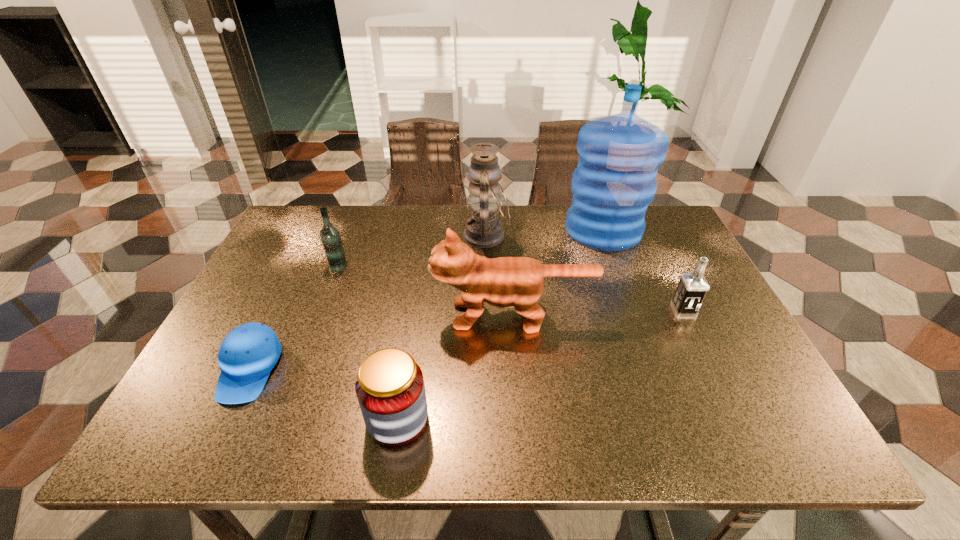
The width and height of the screenshot is (960, 540). What are the coordinates of `free space between the leftmost object and the jar` in the screenshot? It's located at (324, 394).

Find the location of `free space between the jar and the left vodka`. free space between the jar and the left vodka is located at coordinates (368, 342).

The width and height of the screenshot is (960, 540). I want to click on free space between the jar and the sixth shortest object, so click(442, 327).

Identify the location of vacant region between the tallest object and the right vodka. This screenshot has width=960, height=540. (643, 270).

I want to click on vacant space in between the left vodka and the cap, so click(x=294, y=317).

Where is `free space between the tallest object and the farther vodka`? The height and width of the screenshot is (540, 960). free space between the tallest object and the farther vodka is located at coordinates (470, 247).

At what (x,y) coordinates should I click in order to perform the action: click on unoccupied position between the cap and the water jug. Please return your answer as a coordinate pair (x, y). The height and width of the screenshot is (540, 960). Looking at the image, I should click on (426, 299).

Point out which object is positioned as the second nearest to the farther vodka. Please provide its 2D coordinates. Your answer should be formatted as a tuple, i.e. [(x, y)], where the tuple contains the x and y coordinates of a point satisfying the conditions above.

[(503, 282)]

Image resolution: width=960 pixels, height=540 pixels. I want to click on object that is the fifth closest to the left vodka, so click(619, 155).

The height and width of the screenshot is (540, 960). Find the location of `vacant space that satisfies the following two spatial constraints: 1. on the front label of the nearer vodka; 2. on the face of the cat`. vacant space that satisfies the following two spatial constraints: 1. on the front label of the nearer vodka; 2. on the face of the cat is located at coordinates (685, 315).